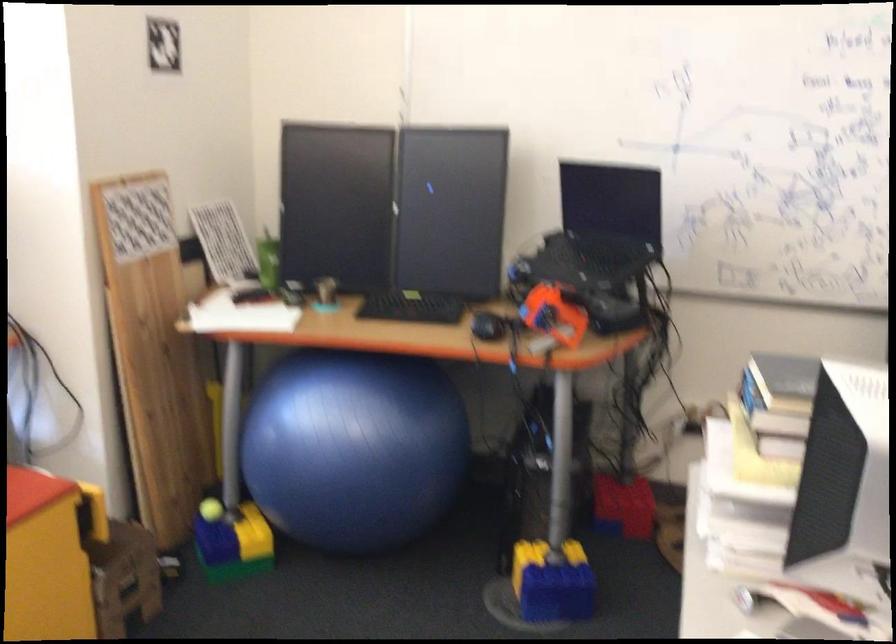
The height and width of the screenshot is (644, 896). Identify the location of stacked book. (778, 402).